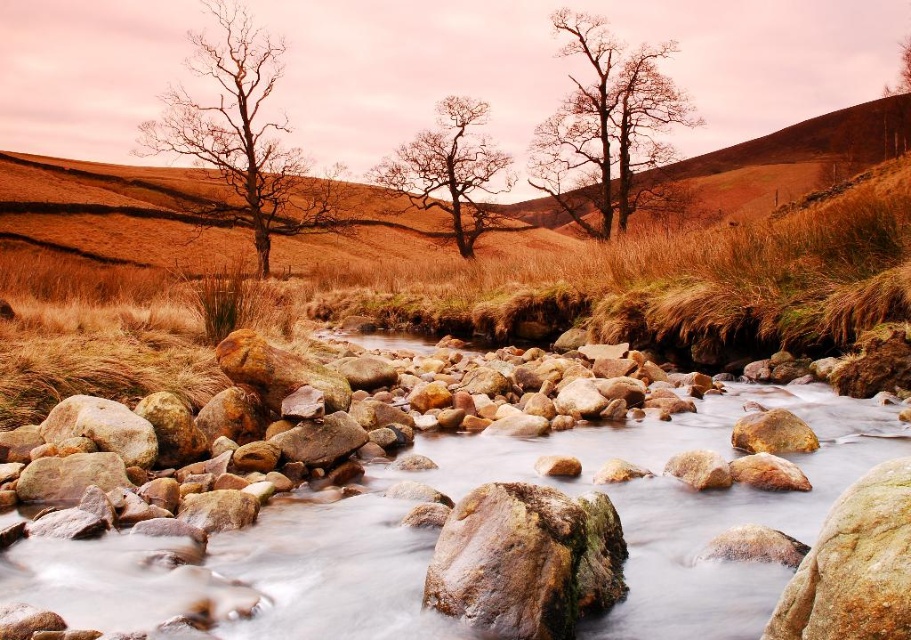
You are standing at the origin point in the image and want to place a small flag exactly where the brown textured rocks at center are located. What are the coordinates where you should place the flag?

The coordinates for the brown textured rocks at center are at point (569, 493), so you should place the flag there.

You are a hiker who wants to cross the stream. You see the brown textured rocks at center and the smooth bark tree at center. Which object is shorter and can be used as a stepping stone?

The brown textured rocks at center is shorter than the smooth bark tree at center, so the brown textured rocks at center can be used as a stepping stone.

You are a hiker trying to cross the stream in the image. You see the brown textured rocks at center and the bare wood tree at upper center. Which object is closer to you, the hiker?

The brown textured rocks at center is positioned under the bare wood tree at upper center, meaning it is closer to you than the tree.